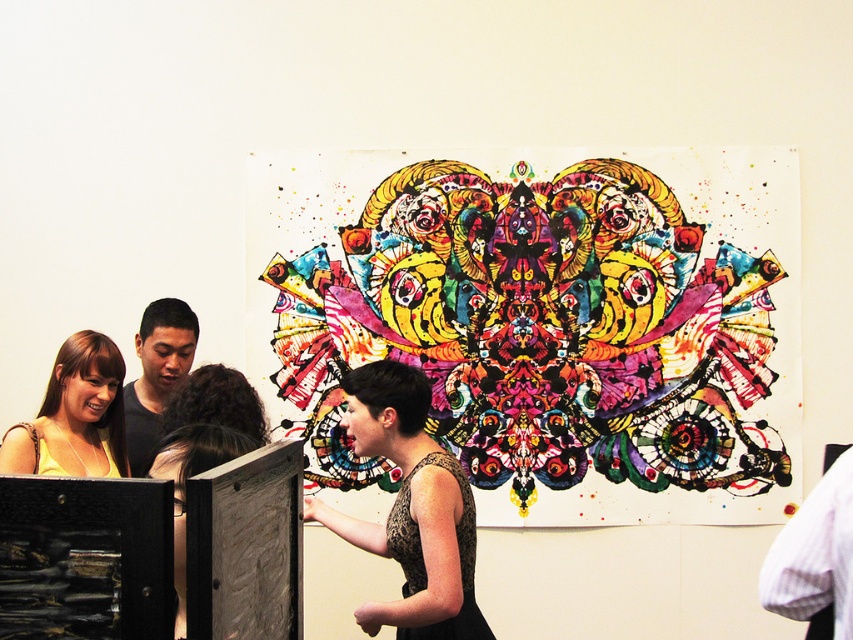
Is black textured dress at center in front of matte yellow dress at lower left?

Yes.

Looking at this image, which is above, black textured dress at center or matte yellow dress at lower left?

Positioned higher is matte yellow dress at lower left.

Identify the location of black textured dress at center. This screenshot has height=640, width=853. (410, 509).

Does vibrant painted artwork at center have a larger size compared to matte yellow dress at lower left?

Indeed, vibrant painted artwork at center has a larger size compared to matte yellow dress at lower left.

Who is more forward, (575, 163) or (120, 404)?

Positioned in front is point (120, 404).

Identify the location of vibrant painted artwork at center. (547, 323).

Can you confirm if vibrant painted artwork at center is wider than matte black shirt at left?

Yes, vibrant painted artwork at center is wider than matte black shirt at left.

Can you confirm if vibrant painted artwork at center is positioned below matte black shirt at left?

Actually, vibrant painted artwork at center is above matte black shirt at left.

Which is in front, point (734, 508) or point (144, 451)?

Positioned in front is point (144, 451).

Locate an element on the screen. vibrant painted artwork at center is located at coordinates (547, 323).